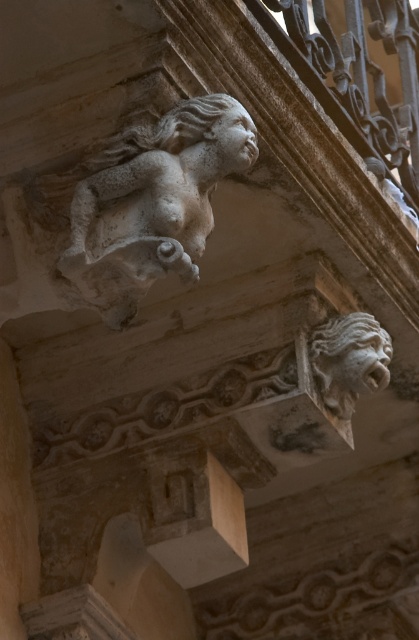
Can you confirm if rough stone gargoyle at upper right is bigger than smooth stone face at upper center?

Indeed, rough stone gargoyle at upper right has a larger size compared to smooth stone face at upper center.

Can you confirm if rough stone gargoyle at upper right is thinner than smooth stone face at upper center?

No.

At what (x,y) coordinates should I click in order to perform the action: click on rough stone gargoyle at upper right. Please return your answer as a coordinate pair (x, y). The height and width of the screenshot is (640, 419). Looking at the image, I should click on (349, 358).

Who is positioned more to the left, white stone cherub at upper left or smooth stone face at upper center?

Positioned to the left is white stone cherub at upper left.

Does white stone cherub at upper left appear on the left side of smooth stone face at upper center?

Yes, white stone cherub at upper left is to the left of smooth stone face at upper center.

Does point (137, 176) come in front of point (248, 113)?

That is True.

In order to click on white stone cherub at upper left in this screenshot , I will do `click(152, 202)`.

Between white stone cherub at upper left and gray stone face at lower right, which one is positioned lower?

gray stone face at lower right is lower down.

Between white stone cherub at upper left and gray stone face at lower right, which one is positioned higher?

white stone cherub at upper left is above.

Is point (206, 156) less distant than point (377, 372)?

Yes, point (206, 156) is in front of point (377, 372).

Image resolution: width=419 pixels, height=640 pixels. In order to click on white stone cherub at upper left in this screenshot , I will do `click(152, 202)`.